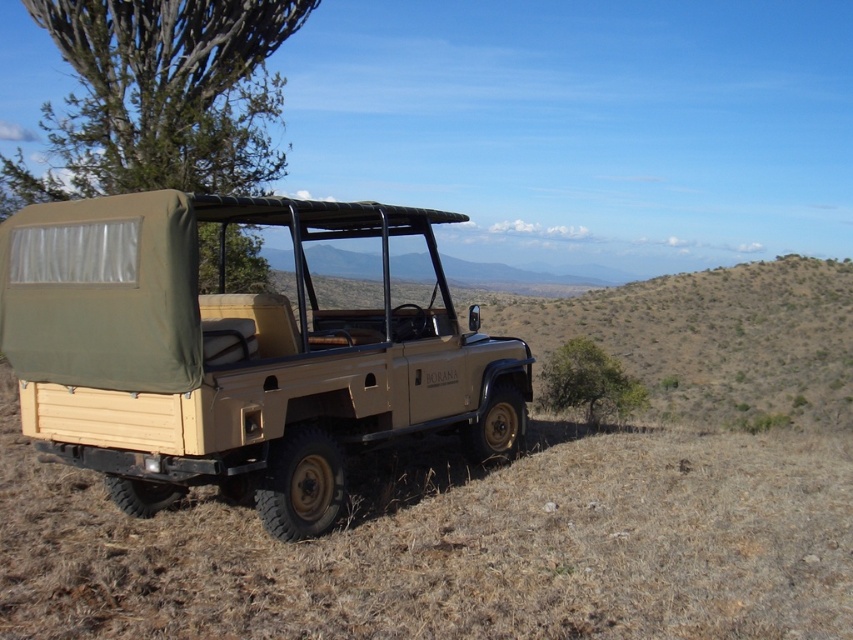
Question: Is matte khaki jeep at center closer to the viewer compared to green leafy tree at upper left?

Choices:
 (A) yes
 (B) no

Answer: (A)

Question: Which object is closer to the camera taking this photo?

Choices:
 (A) green leafy tree at lower right
 (B) green leafy tree at upper left

Answer: (A)

Question: Estimate the real-world distances between objects in this image. Which object is farther from the green leafy tree at lower right?

Choices:
 (A) matte khaki jeep at center
 (B) green leafy tree at upper left

Answer: (B)

Question: Can you confirm if green leafy tree at upper left is positioned to the left of green leafy tree at lower right?

Choices:
 (A) yes
 (B) no

Answer: (A)

Question: Estimate the real-world distances between objects in this image. Which object is closer to the matte khaki jeep at center?

Choices:
 (A) green leafy tree at upper left
 (B) green leafy tree at lower right

Answer: (B)

Question: Does matte khaki jeep at center have a larger size compared to green leafy tree at lower right?

Choices:
 (A) no
 (B) yes

Answer: (A)